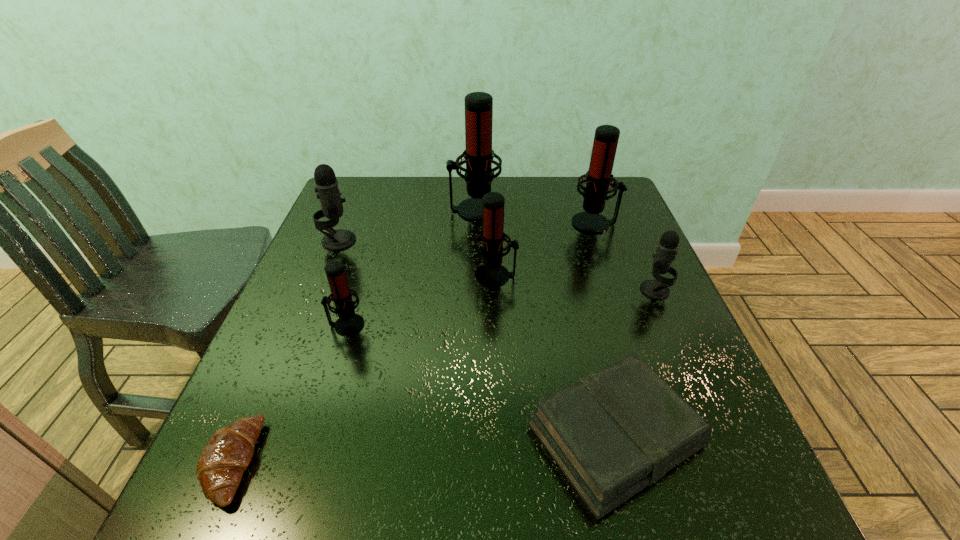
Where is `the nearer black microphone`? The width and height of the screenshot is (960, 540). the nearer black microphone is located at coordinates pos(666,251).

This screenshot has width=960, height=540. Identify the location of greenish book. (612, 433).

Identify the location of the second shortest object. The image size is (960, 540). tap(612, 433).

You are a GUI agent. You are given a task and a screenshot of the screen. Output one action in this format:
    pyautogui.click(x=<x>, y=<y>)
    Task: Click on the shortest object
    This screenshot has width=960, height=540.
    Given the screenshot: What is the action you would take?
    pyautogui.click(x=226, y=456)

You are a GUI agent. You are given a task and a screenshot of the screen. Output one action in this format:
    pyautogui.click(x=<x>, y=<y>)
    Task: Click on the brown crescent roll
    
    Given the screenshot: What is the action you would take?
    pyautogui.click(x=226, y=456)

Where is `free spot located 0.260m on the front of the biggest red microphone`? free spot located 0.260m on the front of the biggest red microphone is located at coordinates (473, 284).

Image resolution: width=960 pixels, height=540 pixels. I want to click on vacant region located 0.290m on the left of the second tallest microphone, so click(467, 223).

Find the location of a particular element. vacant space located on the right of the farther black microphone is located at coordinates point(458,240).

Identify the location of vacant space located 0.330m on the left of the third biggest red microphone. (337, 275).

Locate an element on the screen. The width and height of the screenshot is (960, 540). free space located 0.120m on the front of the fifth microphone from right to left is located at coordinates (328, 384).